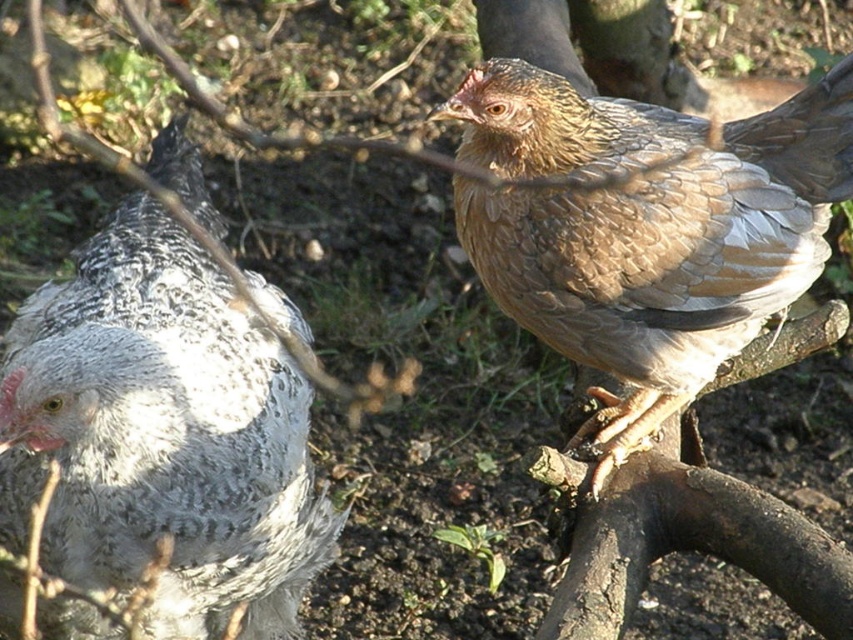
You are standing at the center of the garden and see the speckled feathered chicken at left. Based on its position coordinates, is it closer to the left or right edge of the garden?

The speckled feathered chicken at left is located at point 0.681 on the x and 0.191 on the y axis. Since the x coordinate is closer to 1, it is closer to the right edge of the garden.

You are standing in the garden where both chickens are present. If you face the speckled feathered chicken at left and the brown feathered chicken at upper right, which chicken is positioned to your right side?

The brown feathered chicken at upper right is positioned to your right side since the speckled feathered chicken at left is to the left of it.

You are standing in the garden where the two chickens are. You notice two points marked in the scene. The first point is at coordinate point[28,300] and the second is at point[569,154]. If you want to reach both points, which one will you encounter first as you move forward?

You will encounter point[28,300] first because it is closer to you than point[569,154], which is further away.